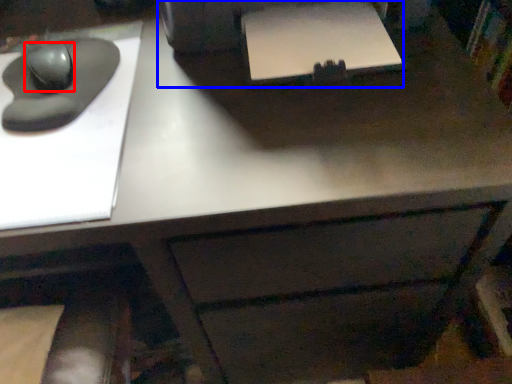
Question: Which of the following is the farthest to the observer, mouse (highlighted by a red box) or printer (highlighted by a blue box)?

Choices:
 (A) mouse
 (B) printer

Answer: (A)